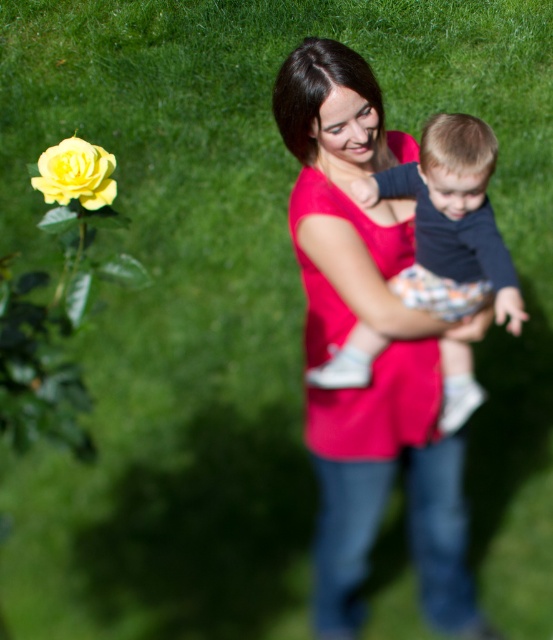
You are a photographer trying to capture a closeup of the yellow matte rose at lower left without the matte pink shirt at center blocking the view. Can you move your camera position to achieve this?

The yellow matte rose at lower left is behind the matte pink shirt at center, so moving the camera position might not help as the rose is already obscured by the shirt from the current angle. You may need to physically move the shirt or the rose to get an unobstructed view.